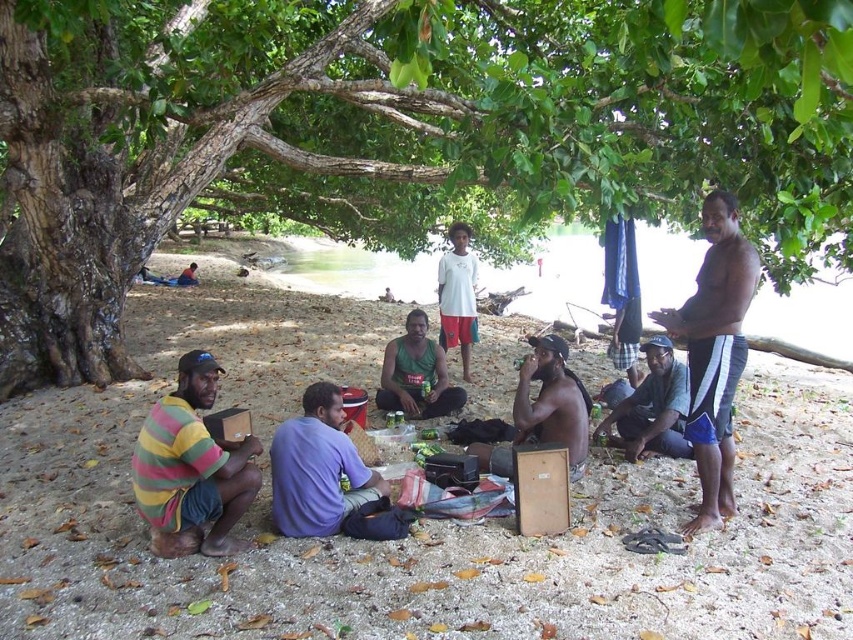
You are standing at the point labeled as point (454, 392) and want to walk towards the point labeled as point (59, 429). Which direction should you face to move directly towards it?

You should face towards the lower right direction because point (59, 429) is in front of point (454, 392).

You are a photographer trying to capture the group under the tree. You notice the brown sand at lower center and the purple fabric shirt at center. Which object in the scene has a bigger size?

The brown sand at lower center has a larger size compared to the purple fabric shirt at center.

You are a photographer trying to capture a photo of the group under the large tree. You notice the brown sand at lower center and the purple fabric shirt at center. Which object should you focus on first if you want to ensure both are in focus?

The brown sand at lower center is taller than the purple fabric shirt at center, so focusing on the brown sand at lower center first would help ensure both are in focus since it is farther away and requires a deeper depth of field.